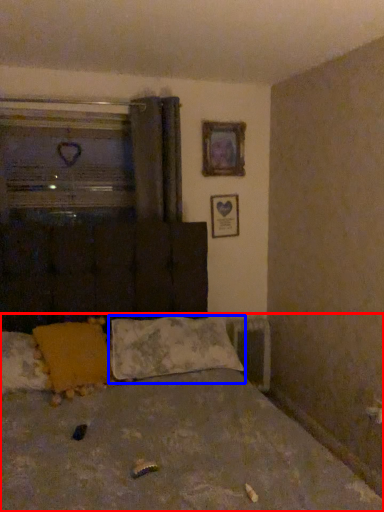
Question: Which object appears farthest to the camera in this image, bed (highlighted by a red box) or pillow (highlighted by a blue box)?

Choices:
 (A) bed
 (B) pillow

Answer: (B)